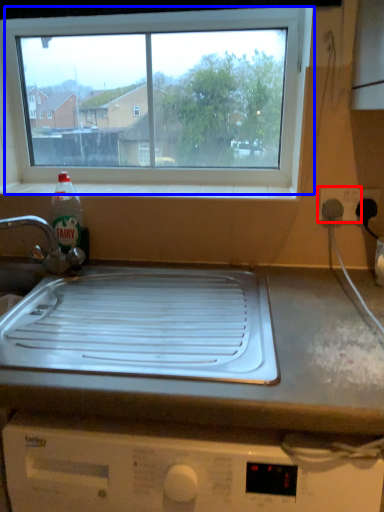
Question: Which of the following is the farthest to the observer, electric outlet (highlighted by a red box) or window (highlighted by a blue box)?

Choices:
 (A) electric outlet
 (B) window

Answer: (B)